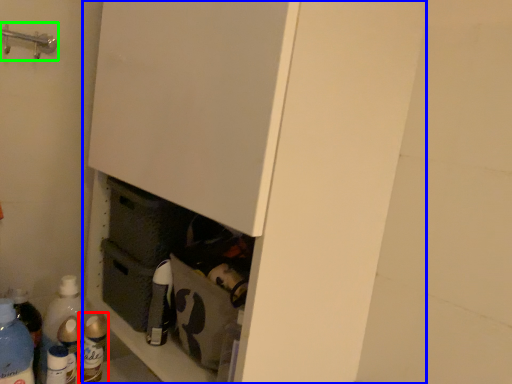
Question: Estimate the real-world distances between objects in this image. Which object is closer to bottle (highlighted by a red box), cupboard (highlighted by a blue box) or door handle (highlighted by a green box)?

Choices:
 (A) cupboard
 (B) door handle

Answer: (A)